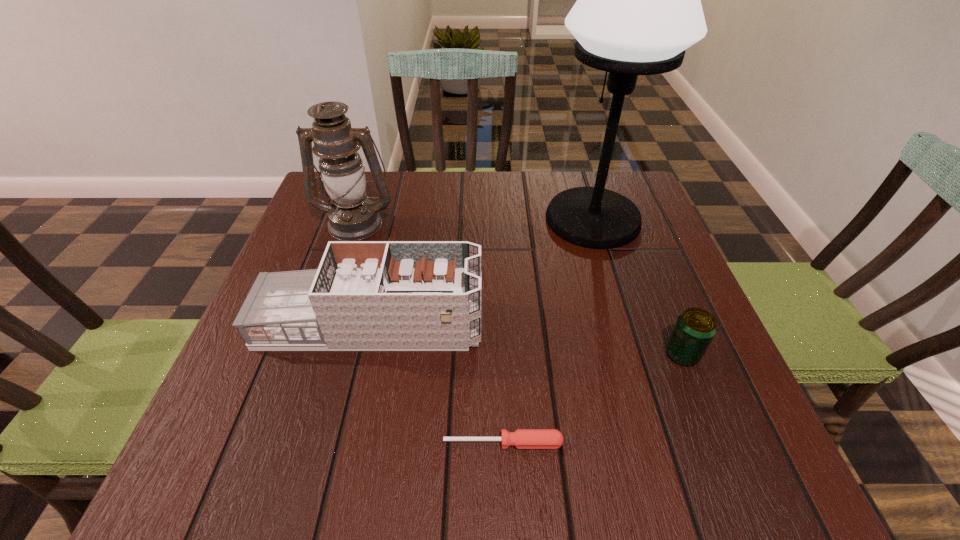
The width and height of the screenshot is (960, 540). In order to click on the tallest object in this screenshot , I will do `click(638, 7)`.

Find the location of `the second tallest object`. the second tallest object is located at coordinates (352, 217).

Locate an element on the screen. The height and width of the screenshot is (540, 960). the third shortest object is located at coordinates click(365, 295).

You are a GUI agent. You are given a task and a screenshot of the screen. Output one action in this format:
    pyautogui.click(x=<x>, y=<y>)
    Task: Click on the fourth tallest object
    The width and height of the screenshot is (960, 540).
    Given the screenshot: What is the action you would take?
    pyautogui.click(x=695, y=328)

Where is `the nearest object`? the nearest object is located at coordinates point(522,438).

This screenshot has height=540, width=960. Identify the location of the shortest object. (522, 438).

Locate an element on the screen. free space located on the front of the table lamp is located at coordinates (615, 292).

You are a GUI agent. You are given a task and a screenshot of the screen. Output one action in this format:
    pyautogui.click(x=<x>, y=<y>)
    Task: Click on the vacant area located 0.220m on the front of the fourth shortest object
    The width and height of the screenshot is (960, 540).
    Given the screenshot: What is the action you would take?
    pyautogui.click(x=326, y=310)

Identify the location of free space located at the entrance of the dollhouse. (598, 325).

At what (x,y) coordinates should I click in order to perform the action: click on free space located on the left of the fourth tallest object. Please return your answer as a coordinate pair (x, y). The image size is (960, 540). Looking at the image, I should click on (530, 354).